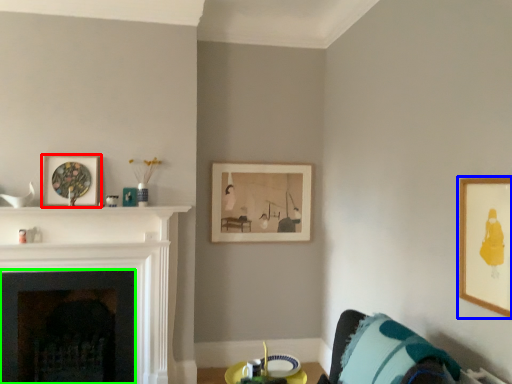
Question: Which is farther away from picture frame (highlighted by a red box)? picture frame (highlighted by a blue box) or fireplace (highlighted by a green box)?

Choices:
 (A) picture frame
 (B) fireplace

Answer: (A)